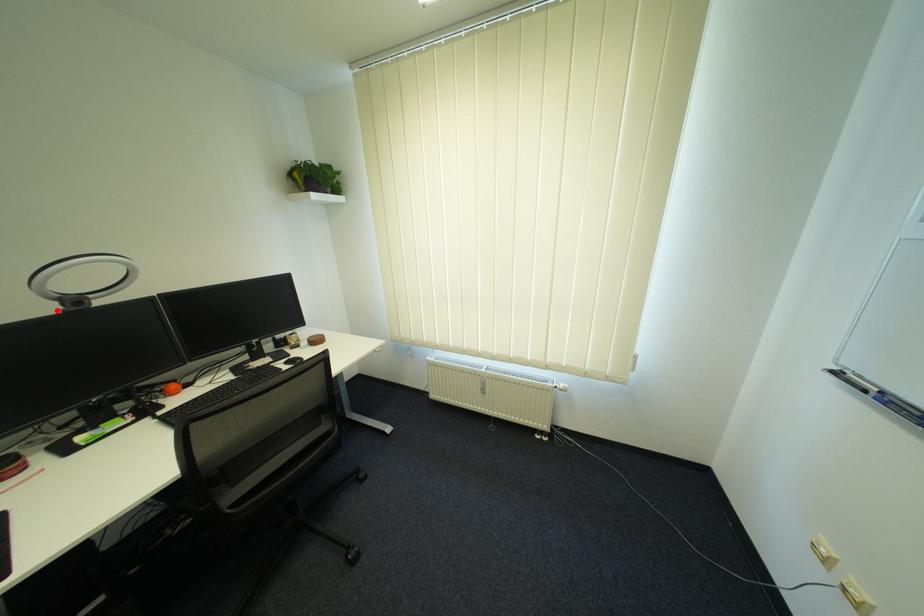
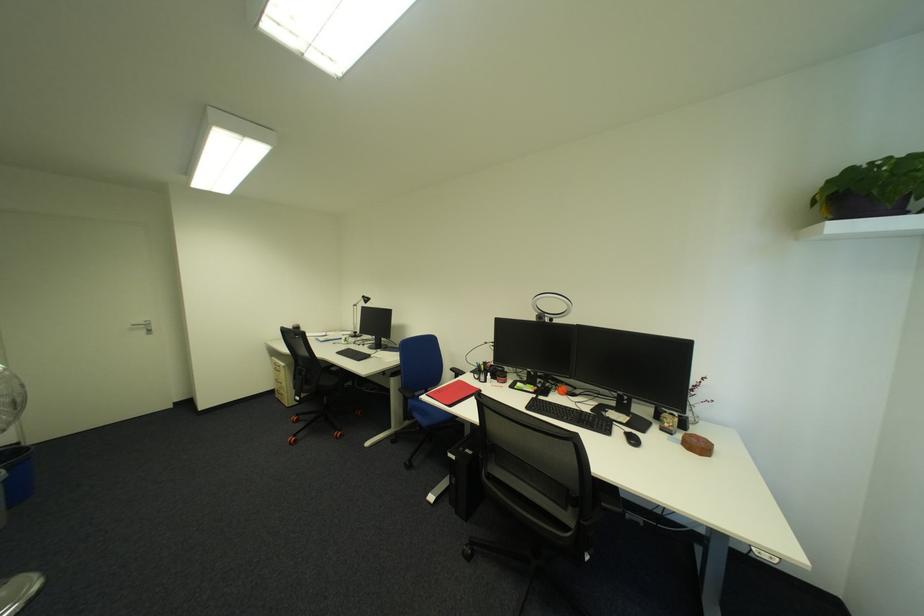
Where in the second image is the point corresponding to the highlighted location from the first image?

(542, 318)